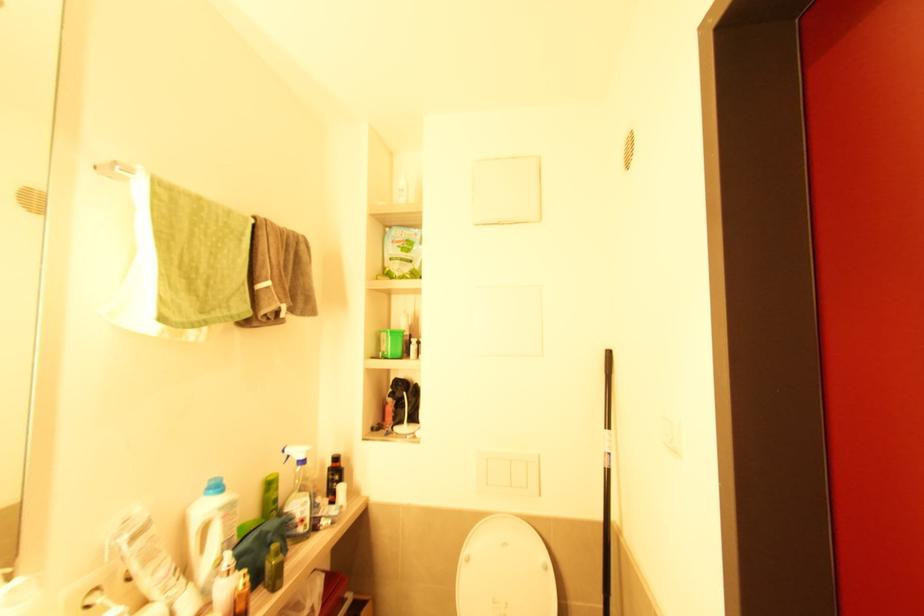
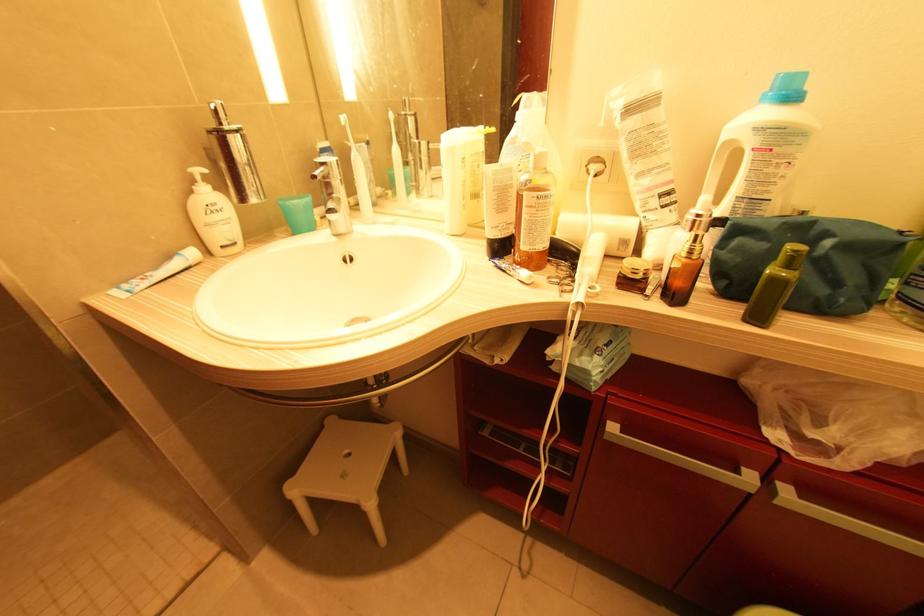
How did the camera likely rotate?

The camera's rotation is toward left-down.